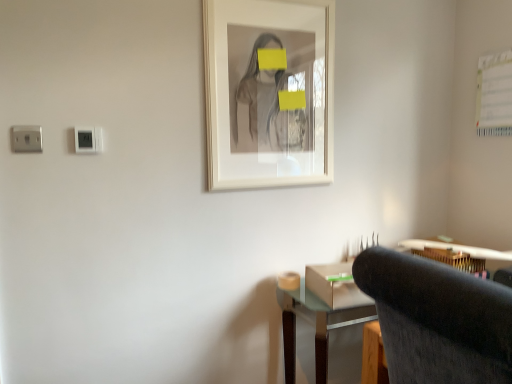
Question: Is wooden desk at lower right smaller than dark gray fabric chair at lower right?

Choices:
 (A) yes
 (B) no

Answer: (A)

Question: Is wooden desk at lower right next to dark gray fabric chair at lower right?

Choices:
 (A) no
 (B) yes

Answer: (A)

Question: Does wooden desk at lower right appear on the right side of dark gray fabric chair at lower right?

Choices:
 (A) no
 (B) yes

Answer: (B)

Question: Is wooden desk at lower right positioned with its back to dark gray fabric chair at lower right?

Choices:
 (A) yes
 (B) no

Answer: (B)

Question: Can you confirm if wooden desk at lower right is thinner than dark gray fabric chair at lower right?

Choices:
 (A) no
 (B) yes

Answer: (B)

Question: In terms of height, does wooden desk at lower right look taller or shorter compared to dark gray fabric chair at lower right?

Choices:
 (A) short
 (B) tall

Answer: (A)

Question: From the image's perspective, is wooden desk at lower right positioned above or below dark gray fabric chair at lower right?

Choices:
 (A) above
 (B) below

Answer: (A)

Question: Is wooden desk at lower right bigger or smaller than dark gray fabric chair at lower right?

Choices:
 (A) small
 (B) big

Answer: (A)

Question: Is wooden desk at lower right in front of or behind dark gray fabric chair at lower right in the image?

Choices:
 (A) front
 (B) behind

Answer: (B)

Question: Looking at their shapes, would you say white matte picture frame at center is wider or thinner than white plastic electric outlet at upper left?

Choices:
 (A) thin
 (B) wide

Answer: (B)

Question: Based on their sizes in the image, would you say white matte picture frame at center is bigger or smaller than white plastic electric outlet at upper left?

Choices:
 (A) big
 (B) small

Answer: (A)

Question: From the image's perspective, is white matte picture frame at center positioned above or below white plastic electric outlet at upper left?

Choices:
 (A) above
 (B) below

Answer: (A)

Question: Is white matte picture frame at center taller or shorter than white plastic electric outlet at upper left?

Choices:
 (A) tall
 (B) short

Answer: (A)

Question: Does point (99, 132) appear closer or farther from the camera than point (433, 248)?

Choices:
 (A) farther
 (B) closer

Answer: (B)

Question: Is white plastic electric outlet at upper left to the left or to the right of wooden desk at lower right in the image?

Choices:
 (A) right
 (B) left

Answer: (B)